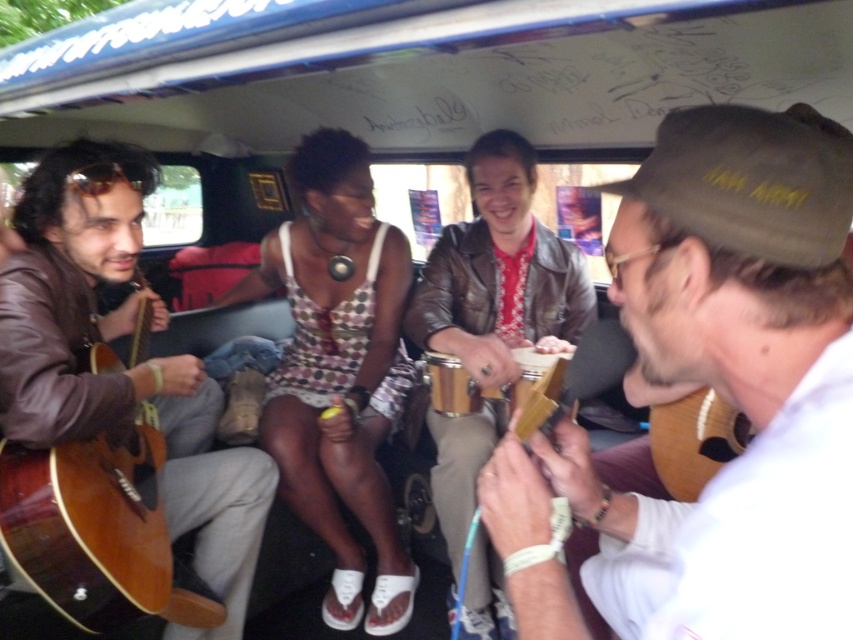
Looking at this image, you are sitting at point (553, 364) in the vehicle. There is another person at point (479, 280). From your current position, which direction is this person located?

The person at point (479, 280) is behind you since the point is located behind your current position at (553, 364).

You are a photographer inside the vehicle and want to take a clear photo of both the matte brown guitar at center and the matte brown guitar at left. Which guitar will appear larger in the photo?

The matte brown guitar at center will appear larger in the photo because it is closer to the viewer than the matte brown guitar at left.